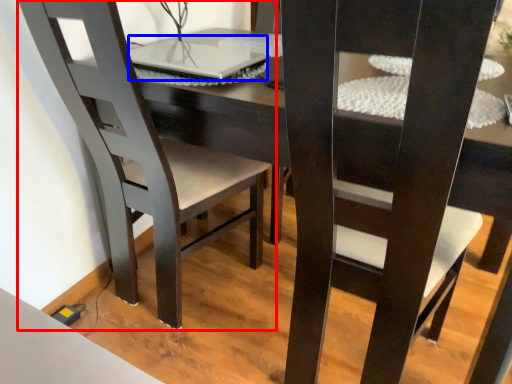
Question: Which of the following is the closest to the observer, chair (highlighted by a red box) or laptop (highlighted by a blue box)?

Choices:
 (A) chair
 (B) laptop

Answer: (A)